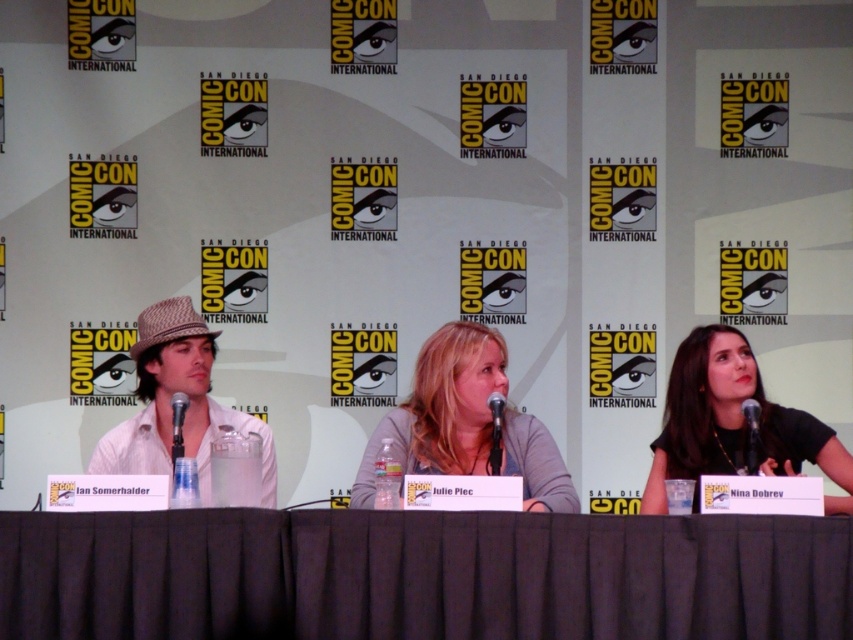
Question: Based on their relative distances, which object is farther from the white cotton shirt at left?

Choices:
 (A) black matte shirt at right
 (B) light gray shirt at center

Answer: (A)

Question: Is light gray shirt at center positioned before black matte shirt at right?

Choices:
 (A) no
 (B) yes

Answer: (B)

Question: Can you confirm if light gray shirt at center is thinner than black matte shirt at right?

Choices:
 (A) yes
 (B) no

Answer: (A)

Question: Based on their relative distances, which object is nearer to the dark fabric table at center?

Choices:
 (A) white cotton shirt at left
 (B) light gray shirt at center
 (C) black matte shirt at right

Answer: (B)

Question: Which of the following is the closest to the observer?

Choices:
 (A) dark fabric table at center
 (B) white cotton shirt at left
 (C) light gray shirt at center

Answer: (A)

Question: Does light gray shirt at center have a larger size compared to black matte shirt at right?

Choices:
 (A) yes
 (B) no

Answer: (B)